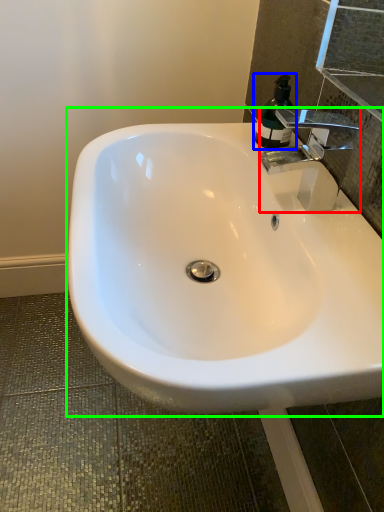
Question: Which is farther away from tap (highlighted by a red box)? soap dispenser (highlighted by a blue box) or sink (highlighted by a green box)?

Choices:
 (A) soap dispenser
 (B) sink

Answer: (B)